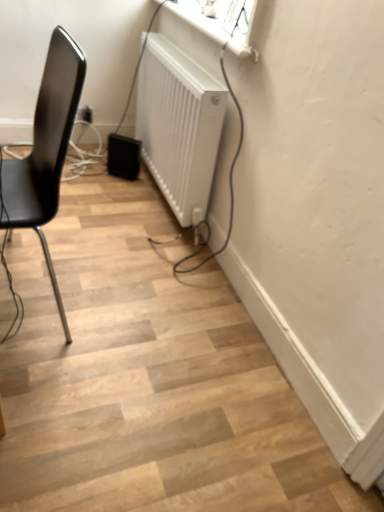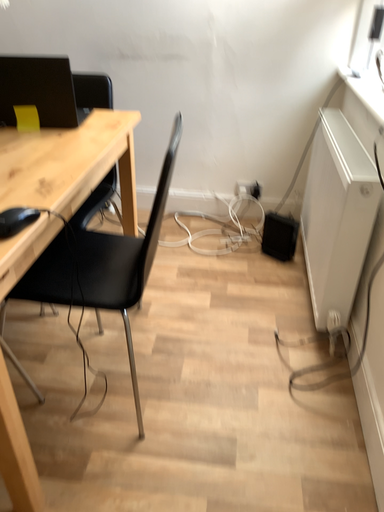
Question: How did the camera likely rotate when shooting the video?

Choices:
 (A) rotated upward
 (B) rotated downward

Answer: (A)